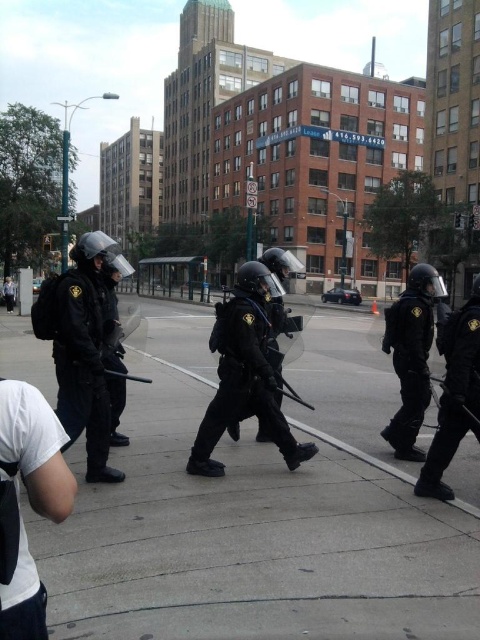
Who is higher up, concrete at center or matte black helmet at right?

matte black helmet at right is higher up.

Is concrete at center smaller than matte black helmet at right?

Actually, concrete at center might be larger than matte black helmet at right.

Which is in front, point (454, 572) or point (412, 301)?

Point (454, 572)

The image size is (480, 640). Find the location of `concrete at center`. concrete at center is located at coordinates [248, 529].

Which is above, concrete at center or matte black helmet at left?

matte black helmet at left is above.

Looking at this image, is concrete at center closer to camera compared to matte black helmet at left?

That is False.

Does point (207, 330) come in front of point (85, 342)?

No, (207, 330) is behind (85, 342).

Identify the location of concrete at center. The height and width of the screenshot is (640, 480). (248, 529).

From the picture: Does matte black helmet at center appear on the right side of matte black helmet at left?

Correct, you'll find matte black helmet at center to the right of matte black helmet at left.

Can you confirm if matte black helmet at center is smaller than matte black helmet at left?

Yes, matte black helmet at center is smaller than matte black helmet at left.

Is point (260, 356) positioned in front of point (60, 413)?

No, it is behind (60, 413).

What are the coordinates of `matte black helmet at center` in the screenshot? It's located at pos(244,372).